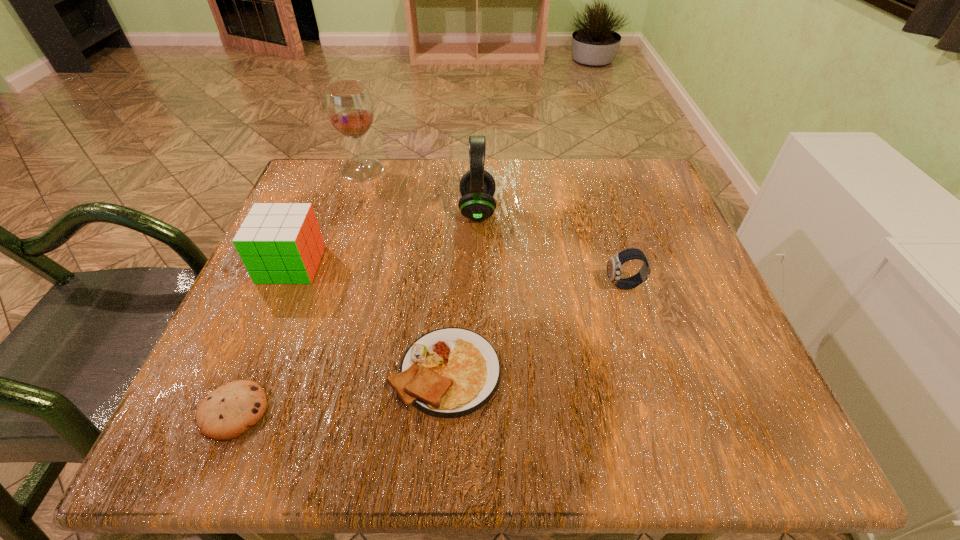
You are a GUI agent. You are given a task and a screenshot of the screen. Output one action in this format:
    pyautogui.click(x=<x>, y=<y>)
    Task: Click on the wineglass
    This screenshot has width=960, height=540.
    Given the screenshot: What is the action you would take?
    pyautogui.click(x=349, y=107)

I want to click on the farthest object, so click(349, 107).

Locate an element on the screen. Image resolution: width=960 pixels, height=540 pixels. the second tallest object is located at coordinates (477, 187).

Where is `headset`? headset is located at coordinates (477, 187).

You are a GUI agent. You are given a task and a screenshot of the screen. Output one action in this format:
    pyautogui.click(x=<x>, y=<y>)
    Task: Click on the cube
    The width and height of the screenshot is (960, 540).
    Given the screenshot: What is the action you would take?
    tap(279, 243)

Identify the location of the rightmost object. Image resolution: width=960 pixels, height=540 pixels. (614, 264).

The width and height of the screenshot is (960, 540). I want to click on watch, so click(x=614, y=264).

This screenshot has width=960, height=540. Find the location of `omelet`. omelet is located at coordinates (451, 372).

This screenshot has width=960, height=540. I want to click on cookie, so click(x=229, y=411).

This screenshot has height=540, width=960. What are the coordinates of `free space located 0.240m on the front of the tallest object` in the screenshot? It's located at (336, 252).